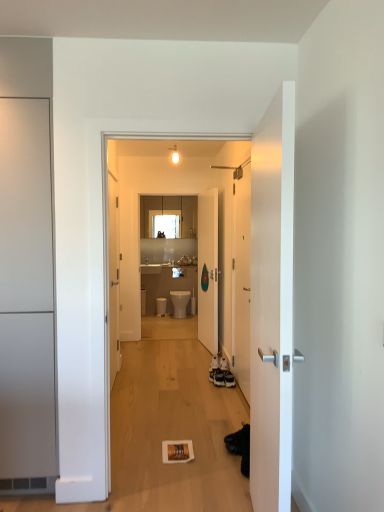
I want to click on vacant area that is in front of white glossy door at center, the 2th door positioned from the back, so click(215, 411).